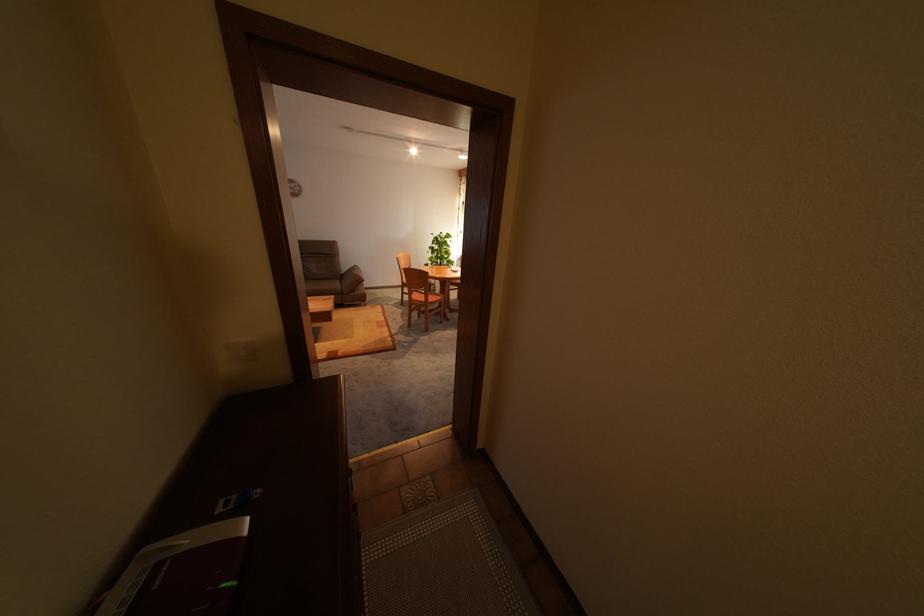
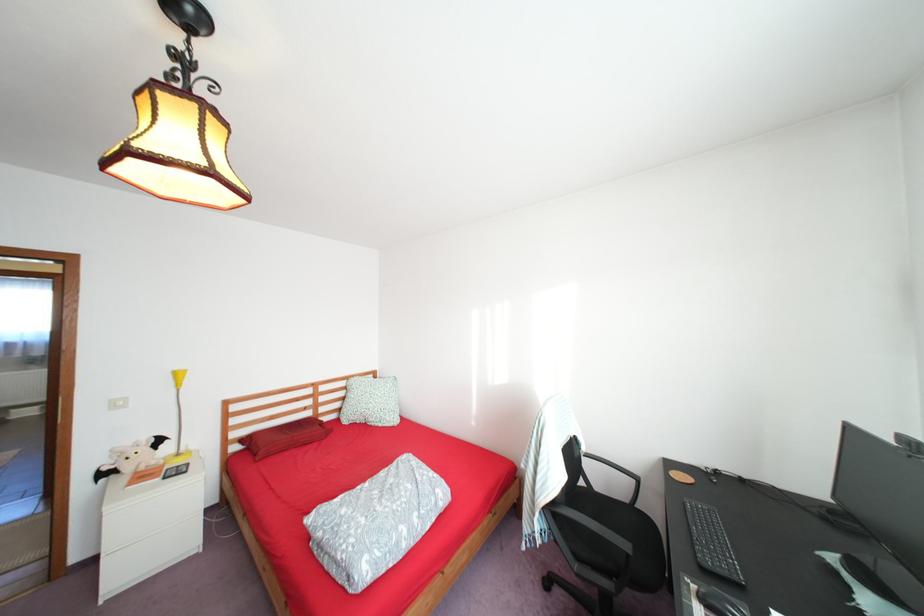
Question: I am providing you with two images of the same scene from different viewpoints. After the viewpoint changes to image2, which objects are now occluded?

Choices:
 (A) silver cordless phone
 (B) bat plush toy
 (C) potted green plant
 (D) white light switch

Answer: (C)